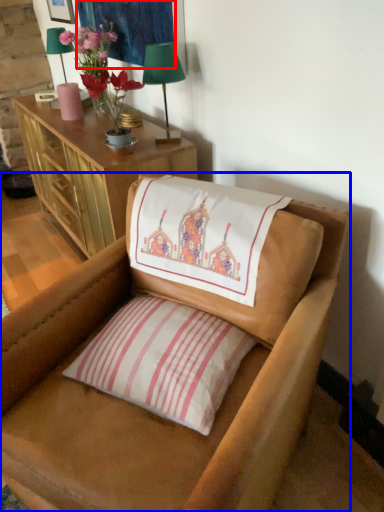
Question: Which point is closer to the camera, tapestry (highlighted by a red box) or chair (highlighted by a blue box)?

Choices:
 (A) tapestry
 (B) chair

Answer: (B)